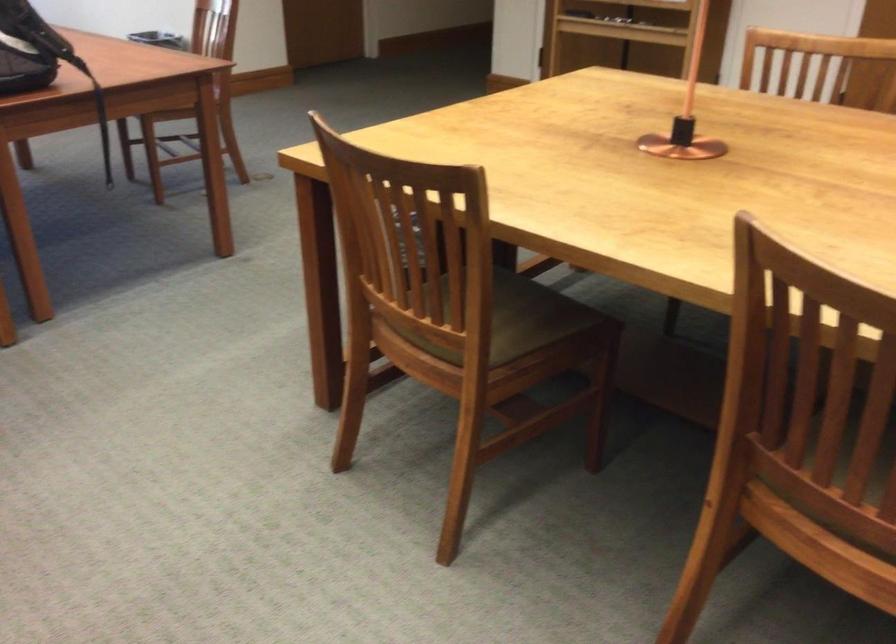
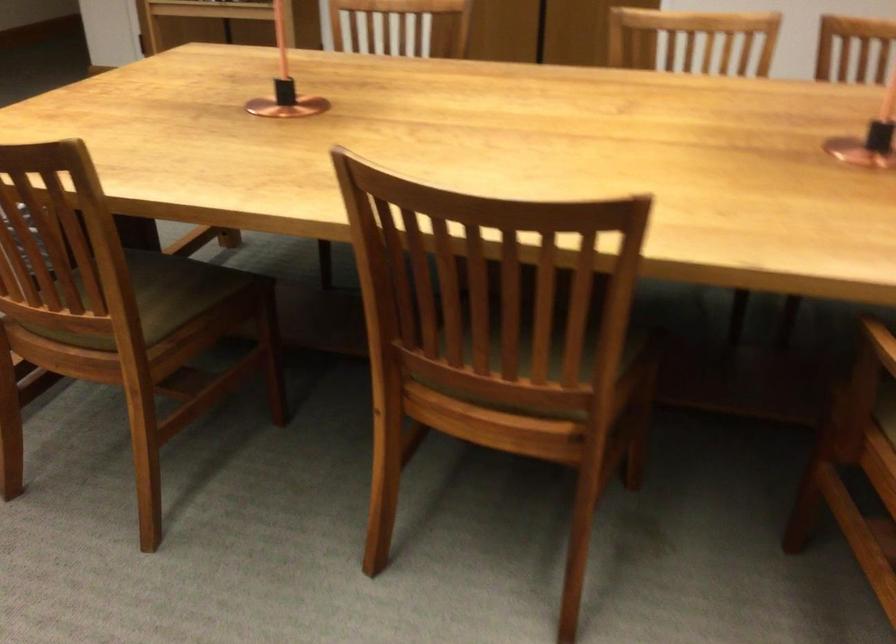
Find the pixel in the second image that matches point 681,120 in the first image.

(285, 84)